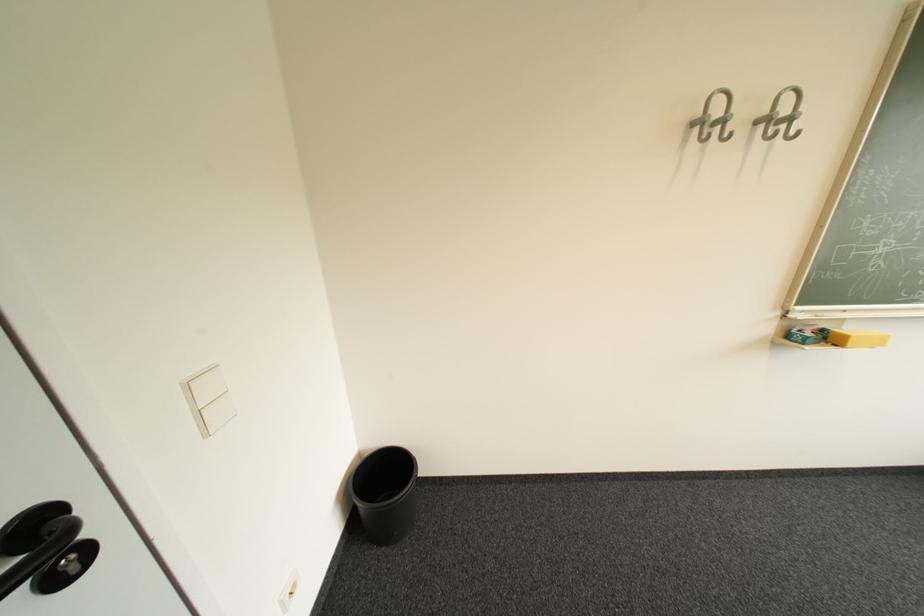
Locate an element on the screen. The image size is (924, 616). black door handle is located at coordinates (79, 562).